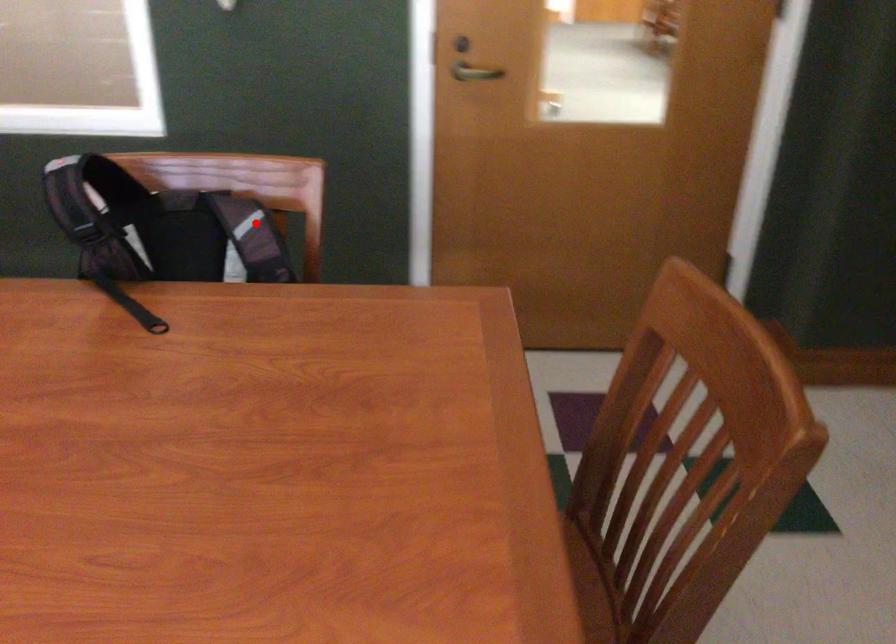
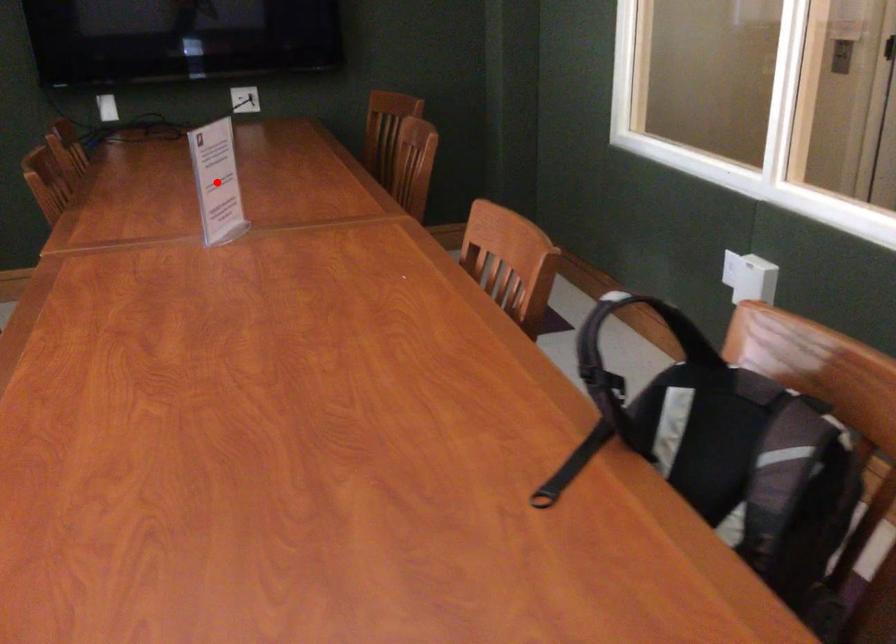
I am providing you with two images of the same scene from different viewpoints. A red point is marked on the first image and another point is marked on the second image. Is the red point in image1 aligned with the point shown in image2?

No